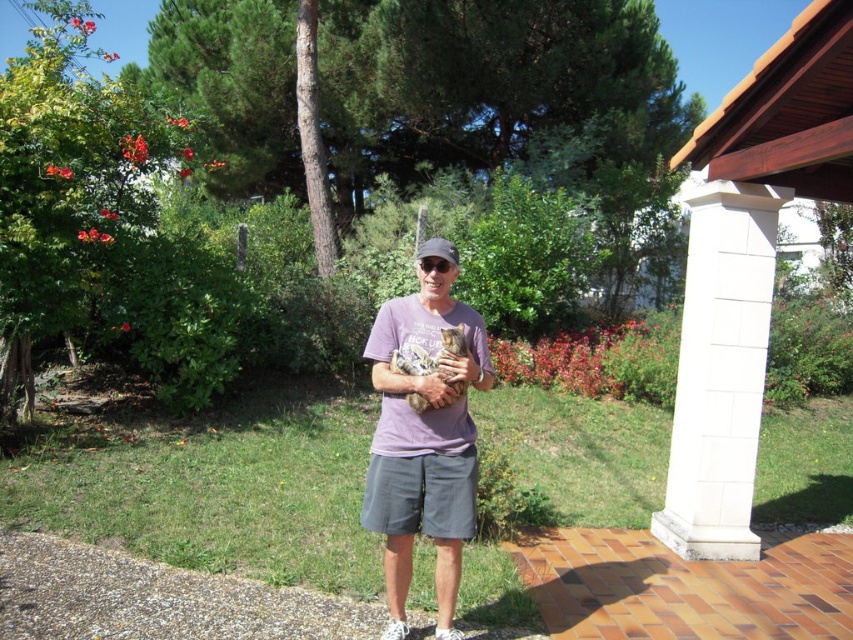
The width and height of the screenshot is (853, 640). Identify the location of white textured column at right. (720, 371).

Between white textured column at right and gray cotton shorts at center, which one is positioned higher?

white textured column at right is above.

Who is more distant from viewer, (706, 484) or (409, 499)?

Point (706, 484)

The height and width of the screenshot is (640, 853). I want to click on white textured column at right, so click(x=720, y=371).

This screenshot has width=853, height=640. What do you see at coordinates (422, 442) in the screenshot?
I see `purple cotton shirt at center` at bounding box center [422, 442].

Who is higher up, purple cotton shirt at center or matte gray baseball cap at center?

matte gray baseball cap at center is above.

The height and width of the screenshot is (640, 853). What do you see at coordinates (422, 442) in the screenshot?
I see `purple cotton shirt at center` at bounding box center [422, 442].

Image resolution: width=853 pixels, height=640 pixels. In order to click on purple cotton shirt at center in this screenshot , I will do `click(422, 442)`.

Between point (364, 522) and point (434, 253), which one is positioned behind?

Positioned behind is point (364, 522).

Who is more distant from viewer, (415, 460) or (445, 241)?

The point (445, 241) is more distant.

The height and width of the screenshot is (640, 853). I want to click on gray cotton shorts at center, so click(x=421, y=493).